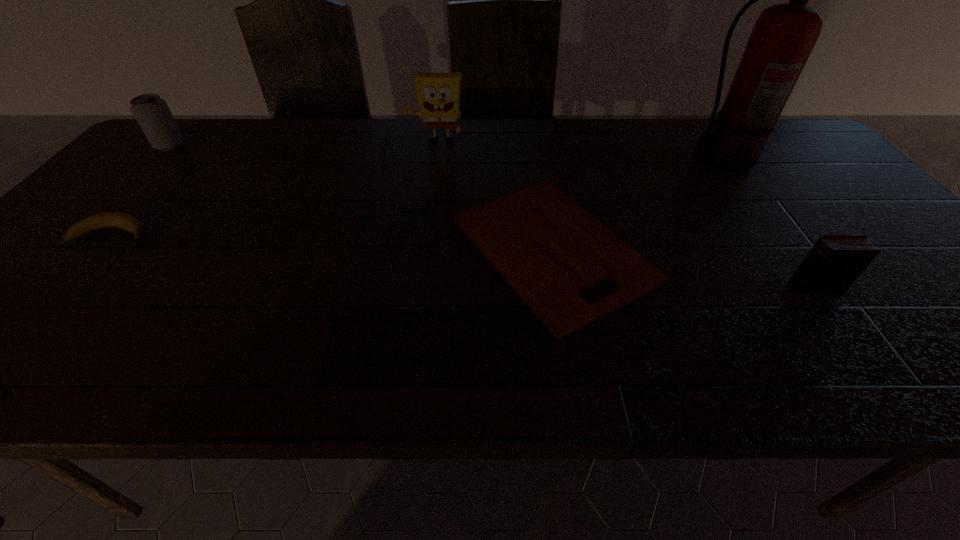
Identify the location of banana that is at the left edge. The height and width of the screenshot is (540, 960). (124, 221).

This screenshot has height=540, width=960. In order to click on object that is positioned at the far left corner in this screenshot , I will do `click(152, 113)`.

You are a GUI agent. You are given a task and a screenshot of the screen. Output one action in this format:
    pyautogui.click(x=<x>, y=<y>)
    Task: Click on the free space at the far edge of the desktop
    The image size is (960, 540).
    Given the screenshot: What is the action you would take?
    pyautogui.click(x=635, y=138)

Where is `vacant space at the near edge of the desktop`? The width and height of the screenshot is (960, 540). vacant space at the near edge of the desktop is located at coordinates (301, 365).

Locate an element on the screen. vacant area at the left edge is located at coordinates (66, 280).

This screenshot has height=540, width=960. What are the coordinates of `vacant space at the right edge` in the screenshot? It's located at (955, 300).

Identify the location of vacant space that's between the second shortest object and the tallest object. This screenshot has height=540, width=960. (418, 197).

I want to click on free spot between the diary and the banana, so click(x=464, y=261).

At what (x,y) coordinates should I click in order to perform the action: click on vacant space that is in between the fire extinguisher and the chopping board. Please return your answer as a coordinate pair (x, y). This screenshot has width=960, height=540. Looking at the image, I should click on (637, 204).

Identify the location of empty location between the sponge and the diary. This screenshot has height=540, width=960. (625, 215).